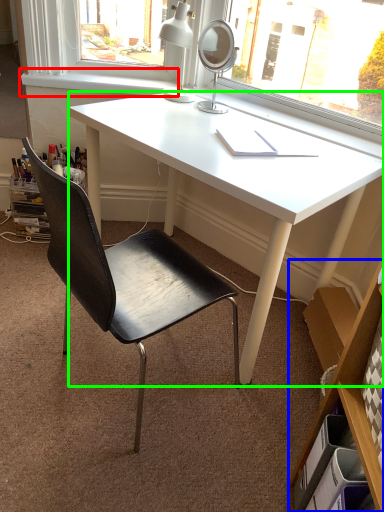
Question: Which object is positioned closest to window sill (highlighted by a red box)? Select from bookshelf (highlighted by a blue box) and desk (highlighted by a green box).

Choices:
 (A) bookshelf
 (B) desk

Answer: (B)